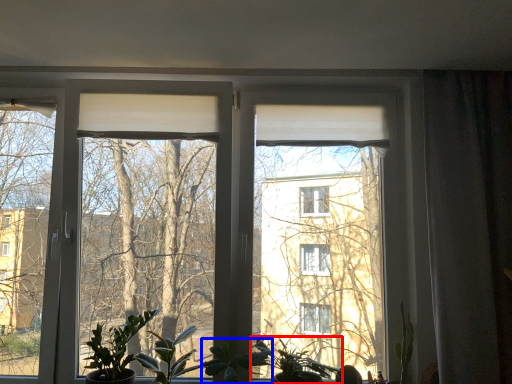
Question: Which object is further to the camera taking this photo, houseplant (highlighted by a red box) or plant (highlighted by a blue box)?

Choices:
 (A) houseplant
 (B) plant

Answer: (A)